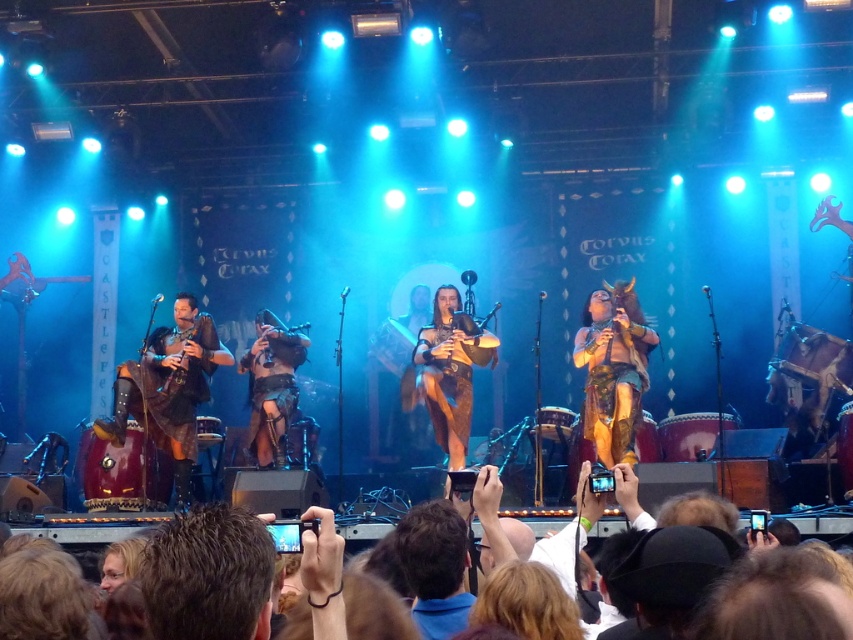
Consider the image. Does brown leather bagpipes at center have a greater width compared to wooden bagpipes at left?

Correct, the width of brown leather bagpipes at center exceeds that of wooden bagpipes at left.

Who is taller, brown leather bagpipes at center or wooden bagpipes at left?

Standing taller between the two is brown leather bagpipes at center.

Is point (453, 436) closer to viewer compared to point (181, 371)?

No.

Where is `brown leather bagpipes at center`? brown leather bagpipes at center is located at coordinates (450, 371).

Between leather bagpipes at left and brown leather bagpipes at center, which one has less height?

brown leather bagpipes at center

Is point (178, 432) behind point (463, 449)?

That is False.

Measure the distance between point (195,449) and camera.

A distance of 18.88 meters exists between point (195,449) and camera.

The width and height of the screenshot is (853, 640). Identify the location of leather bagpipes at left. (x=167, y=388).

Is leather-like brown vest at right wider than leather/rough bagpipes at center?

Correct, the width of leather-like brown vest at right exceeds that of leather/rough bagpipes at center.

Can you confirm if leather-like brown vest at right is bigger than leather/rough bagpipes at center?

Yes, leather-like brown vest at right is bigger than leather/rough bagpipes at center.

Which is in front, point (616, 380) or point (253, 406)?

Point (616, 380)

Locate an element on the screen. leather-like brown vest at right is located at coordinates (612, 371).